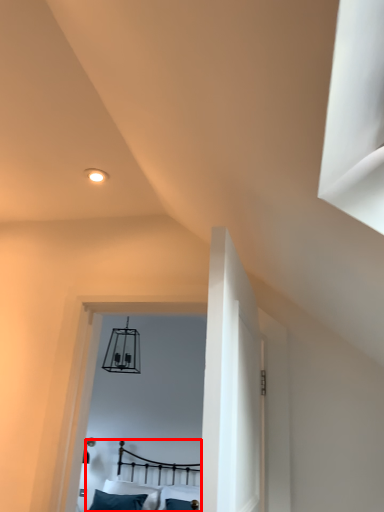
Question: Where is bed (annotated by the red box) located in relation to pillow in the image?

Choices:
 (A) right
 (B) left

Answer: (A)